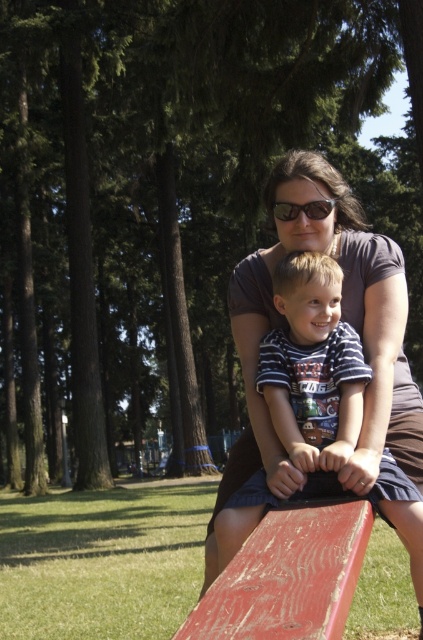
Locate an element on the screen. The width and height of the screenshot is (423, 640). striped cotton shirt at center is located at coordinates (313, 365).

Based on the photo, is striped cotton shirt at center above matte black sunglasses at center?

Actually, striped cotton shirt at center is below matte black sunglasses at center.

Who is more distant from viewer, (335,416) or (313,211)?

Positioned behind is point (313,211).

What are the coordinates of `striped cotton shirt at center` in the screenshot? It's located at (313, 365).

Who is more distant from viewer, (316, 184) or (304, 392)?

The point (316, 184) is more distant.

Is point (224, 472) positioned after point (354, 392)?

Yes, point (224, 472) is farther from viewer.

Identify the location of matte brown shirt at center. (343, 320).

Based on the photo, does matte brown shirt at center have a lesser width compared to matte black sunglasses at center?

In fact, matte brown shirt at center might be wider than matte black sunglasses at center.

Does matte brown shirt at center appear under matte black sunglasses at center?

Indeed, matte brown shirt at center is positioned under matte black sunglasses at center.

Who is more forward, (397, 289) or (288, 211)?

Positioned in front is point (288, 211).

Where is `matte brown shirt at center`? The image size is (423, 640). matte brown shirt at center is located at coordinates (343, 320).